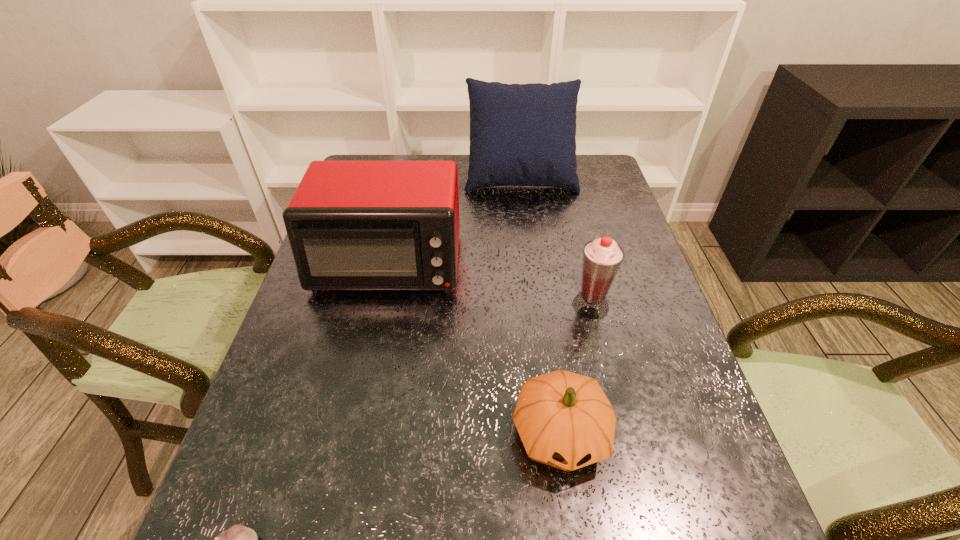
Where is `object positioned at the left edge`? The height and width of the screenshot is (540, 960). object positioned at the left edge is located at coordinates (352, 225).

Image resolution: width=960 pixels, height=540 pixels. Identify the location of cushion present at the right edge. (520, 134).

Where is `smoothie present at the right edge`? smoothie present at the right edge is located at coordinates (602, 257).

I want to click on object located in the far right corner section of the desktop, so click(520, 134).

Find the location of a particular element. The height and width of the screenshot is (540, 960). vacant region at the left edge is located at coordinates (283, 335).

In the image, there is a desktop. At what (x,y) coordinates should I click in order to perform the action: click on vacant space at the right edge. Please return your answer as a coordinate pair (x, y). Image resolution: width=960 pixels, height=540 pixels. Looking at the image, I should click on (747, 510).

Identify the location of vacant area at the far right corner. The height and width of the screenshot is (540, 960). (591, 154).

The width and height of the screenshot is (960, 540). I want to click on empty space that is in between the farthest object and the smoothie, so (556, 239).

What are the coordinates of `free point between the toaster oven and the smoothie` in the screenshot? It's located at (489, 285).

The width and height of the screenshot is (960, 540). What are the coordinates of `the closest object to the garlic` in the screenshot? It's located at (564, 419).